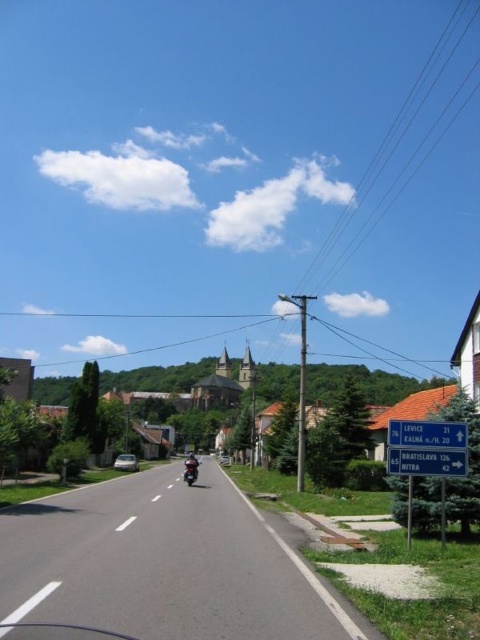
Question: Is blue plastic sign at upper right further to the viewer compared to shiny black motorcycle at center?

Choices:
 (A) no
 (B) yes

Answer: (A)

Question: Which object is closer to the camera taking this photo?

Choices:
 (A) white plastic sign at center right
 (B) shiny black motorcycle at center

Answer: (A)

Question: Among these objects, which one is farthest from the camera?

Choices:
 (A) shiny black motorcycle at center
 (B) white plastic sign at center right

Answer: (A)

Question: Is white plastic sign at center right positioned in front of shiny black motorcycle at center?

Choices:
 (A) yes
 (B) no

Answer: (A)

Question: Can you confirm if white plastic sign at center right is positioned to the right of blue plastic sign at upper right?

Choices:
 (A) yes
 (B) no

Answer: (B)

Question: Which of the following is the closest to the observer?

Choices:
 (A) shiny black motorcycle at center
 (B) blue plastic sign at upper right
 (C) white plastic sign at center right

Answer: (C)